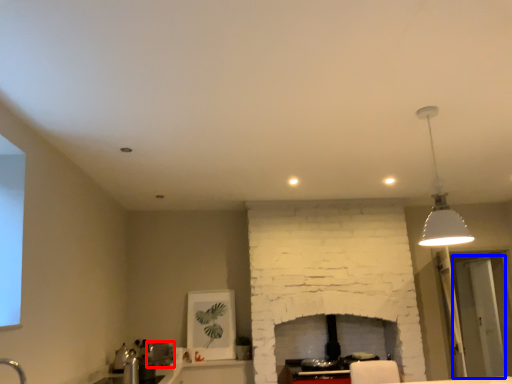
Question: Which of the following is the closest to the observer, appliance (highlighted by a red box) or glass door (highlighted by a blue box)?

Choices:
 (A) appliance
 (B) glass door

Answer: (A)